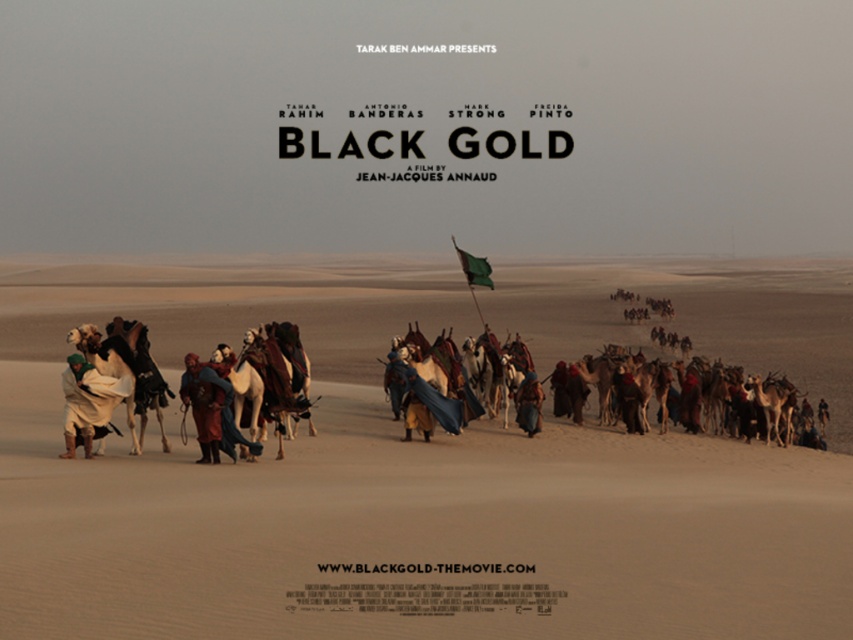
You are a costume designer reviewing the promotional poster for the film Black Gold. You need to determine the spatial relationship between the white woolen robe at left and the blue fabric robe at center. Based on the poster, which robe appears closer to the viewer?

The white woolen robe at left is in front of the blue fabric robe at center, so it appears closer to the viewer.

You are an actor in the movie and need to locate your costume and prop for the next scene. The director says you need to find the white woolen robe at left and the green fabric flag at center. Based on the poster, which object is positioned lower in the image?

The white woolen robe at left is positioned below the green fabric flag at center, so the white woolen robe at left is lower in the image.

You are designing a poster for a movie about survival in a desert. You have to place the desert sand at center and white woolen robe at left. Which object should you make bigger to emphasize the desert environment?

The desert sand at center should be made larger than the white woolen robe at left to emphasize the desert environment since the desert sand at center is larger in size than the white woolen robe at left.